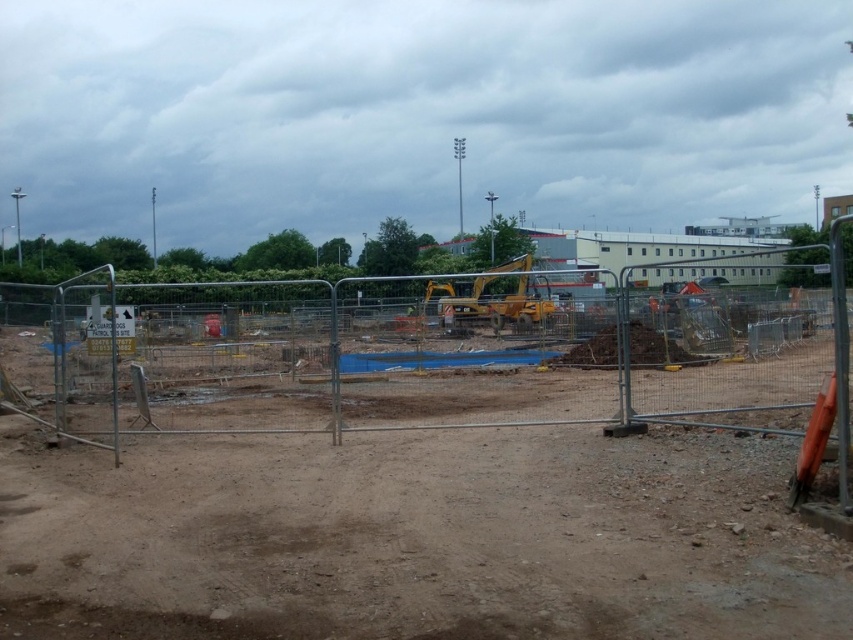
Between brown dirt at center and metal fence at center, which one is positioned lower?

brown dirt at center

Who is more forward, (155, 584) or (267, 296)?

Point (155, 584) is more forward.

Is point (602, 502) positioned behind point (144, 428)?

No, it is in front of (144, 428).

Where is `brown dirt at center`? This screenshot has width=853, height=640. brown dirt at center is located at coordinates (408, 540).

Can you confirm if brown dirt at center is shorter than yellow metallic excavator at center?

Indeed, brown dirt at center has a lesser height compared to yellow metallic excavator at center.

Between point (489, 474) and point (447, 282), which one is positioned in front?

Positioned in front is point (489, 474).

Does point (462, 624) come farther from viewer compared to point (515, 301)?

No, (462, 624) is in front of (515, 301).

You are a GUI agent. You are given a task and a screenshot of the screen. Output one action in this format:
    pyautogui.click(x=<x>, y=<y>)
    Task: Click on the brown dirt at center
    This screenshot has height=640, width=853.
    Given the screenshot: What is the action you would take?
    pyautogui.click(x=408, y=540)

Who is positioned more to the left, metal fence at center or yellow metallic excavator at center?

Positioned to the left is metal fence at center.

Locate an element on the screen. This screenshot has height=640, width=853. metal fence at center is located at coordinates (366, 355).